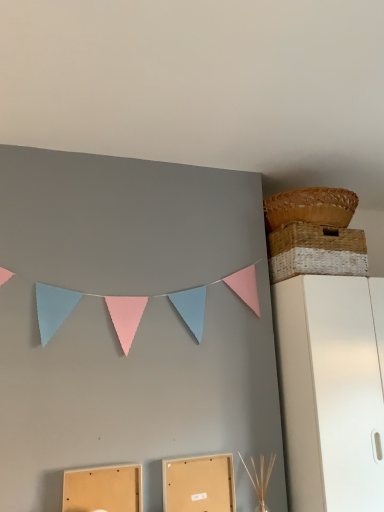
Question: Is woven natural basket at upper right, the 2th basket when ordered from top to bottom, at the left side of woven brown basket at upper right, which appears as the 2th basket when ordered from the bottom?

Choices:
 (A) yes
 (B) no

Answer: (B)

Question: Is woven natural basket at upper right, which is counted as the 1th basket, starting from the bottom, positioned beyond the bounds of woven brown basket at upper right, which appears as the 2th basket when ordered from the bottom?

Choices:
 (A) yes
 (B) no

Answer: (A)

Question: From a real-world perspective, is woven natural basket at upper right, the 2th basket when ordered from top to bottom, positioned under woven brown basket at upper right, which appears as the 2th basket when ordered from the bottom, based on gravity?

Choices:
 (A) yes
 (B) no

Answer: (A)

Question: From a real-world perspective, is woven natural basket at upper right, the 2th basket when ordered from top to bottom, located higher than woven brown basket at upper right, which appears as the first basket when viewed from the top?

Choices:
 (A) yes
 (B) no

Answer: (B)

Question: Considering the relative sizes of woven natural basket at upper right, the 2th basket when ordered from top to bottom, and woven brown basket at upper right, which appears as the first basket when viewed from the top, in the image provided, is woven natural basket at upper right, the 2th basket when ordered from top to bottom, smaller than woven brown basket at upper right, which appears as the first basket when viewed from the top,?

Choices:
 (A) no
 (B) yes

Answer: (A)

Question: Is matte cardboard box at lower center, the 2th cardboard box viewed from the right, bigger or smaller than matte cardboard box at lower center, positioned as the first cardboard box in right-to-left order?

Choices:
 (A) big
 (B) small

Answer: (A)

Question: From the image's perspective, relative to matte cardboard box at lower center, positioned as the first cardboard box in right-to-left order, is matte cardboard box at lower center, the 2th cardboard box viewed from the right, above or below?

Choices:
 (A) below
 (B) above

Answer: (B)

Question: Based on their positions, is matte cardboard box at lower center, the 2th cardboard box viewed from the right, located to the left or right of matte cardboard box at lower center, positioned as the second cardboard box in left-to-right order?

Choices:
 (A) left
 (B) right

Answer: (A)

Question: Is matte cardboard box at lower center, which is the 1th cardboard box in left-to-right order, inside the boundaries of matte cardboard box at lower center, positioned as the first cardboard box in right-to-left order, or outside?

Choices:
 (A) outside
 (B) inside

Answer: (A)

Question: Considering the positions of white matte cabinet at right and matte cardboard box at lower center, positioned as the second cardboard box in left-to-right order, in the image, is white matte cabinet at right taller or shorter than matte cardboard box at lower center, positioned as the second cardboard box in left-to-right order,?

Choices:
 (A) tall
 (B) short

Answer: (A)

Question: Is white matte cabinet at right in front of or behind matte cardboard box at lower center, positioned as the first cardboard box in right-to-left order, in the image?

Choices:
 (A) front
 (B) behind

Answer: (A)

Question: Looking at the image, does white matte cabinet at right seem bigger or smaller compared to matte cardboard box at lower center, positioned as the second cardboard box in left-to-right order?

Choices:
 (A) big
 (B) small

Answer: (A)

Question: Would you say white matte cabinet at right is to the left or to the right of matte cardboard box at lower center, positioned as the second cardboard box in left-to-right order, in the picture?

Choices:
 (A) right
 (B) left

Answer: (A)

Question: Choose the correct answer: Is matte cardboard box at lower center, the 2th cardboard box viewed from the right, inside woven natural basket at upper right, which is counted as the 1th basket, starting from the bottom, or outside it?

Choices:
 (A) outside
 (B) inside

Answer: (A)

Question: In terms of height, does matte cardboard box at lower center, the 2th cardboard box viewed from the right, look taller or shorter compared to woven natural basket at upper right, the 2th basket when ordered from top to bottom?

Choices:
 (A) short
 (B) tall

Answer: (B)